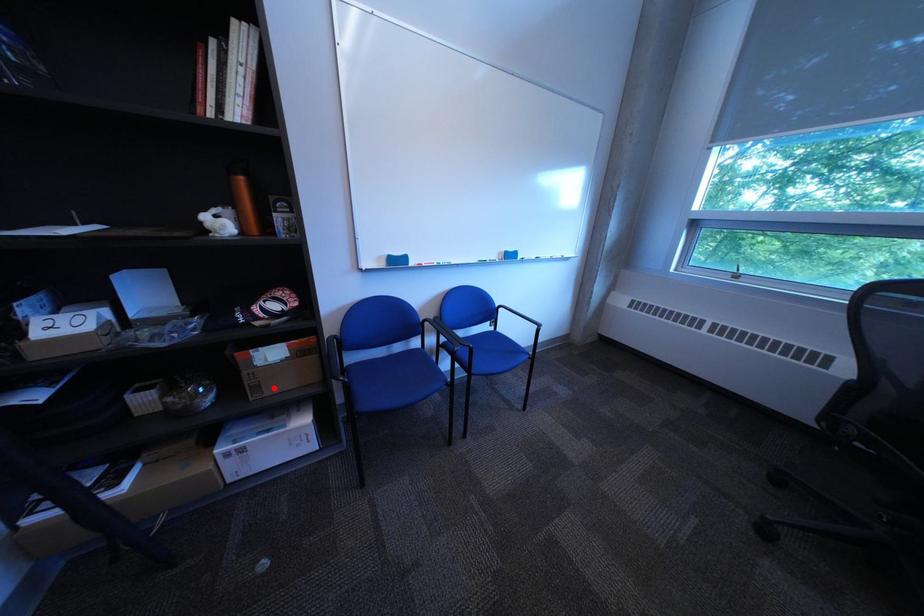
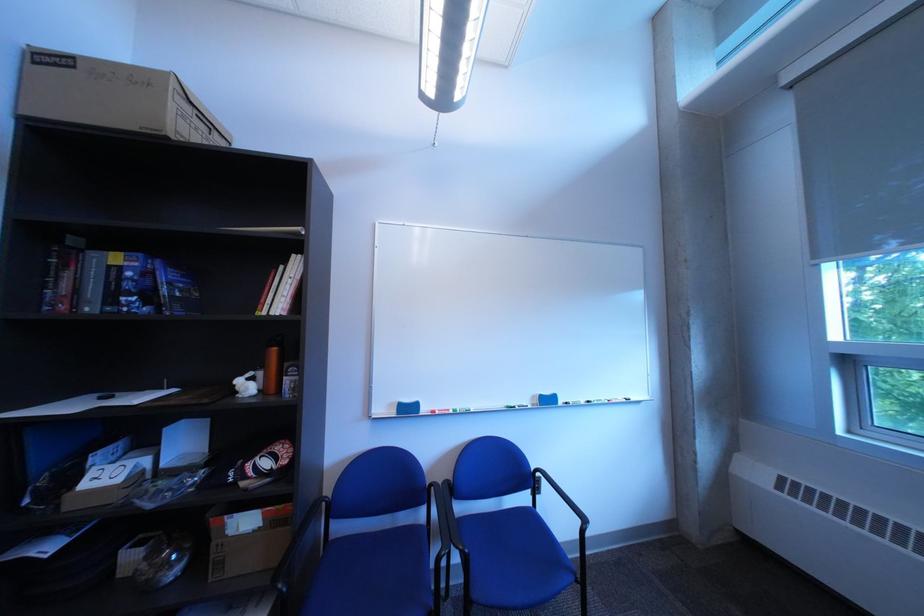
Where in the second image is the point corresponding to the highlighted location from the first image?

(237, 565)